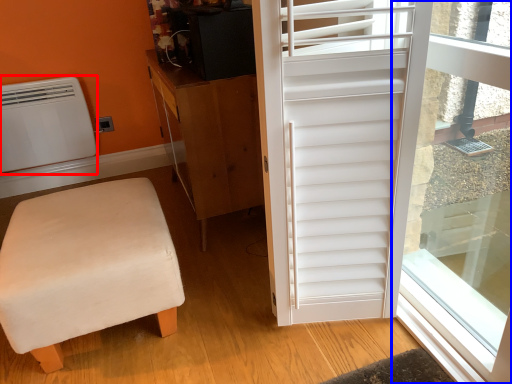
Question: Which object appears farthest to the camera in this image, air conditioning (highlighted by a red box) or window screen (highlighted by a blue box)?

Choices:
 (A) air conditioning
 (B) window screen

Answer: (A)